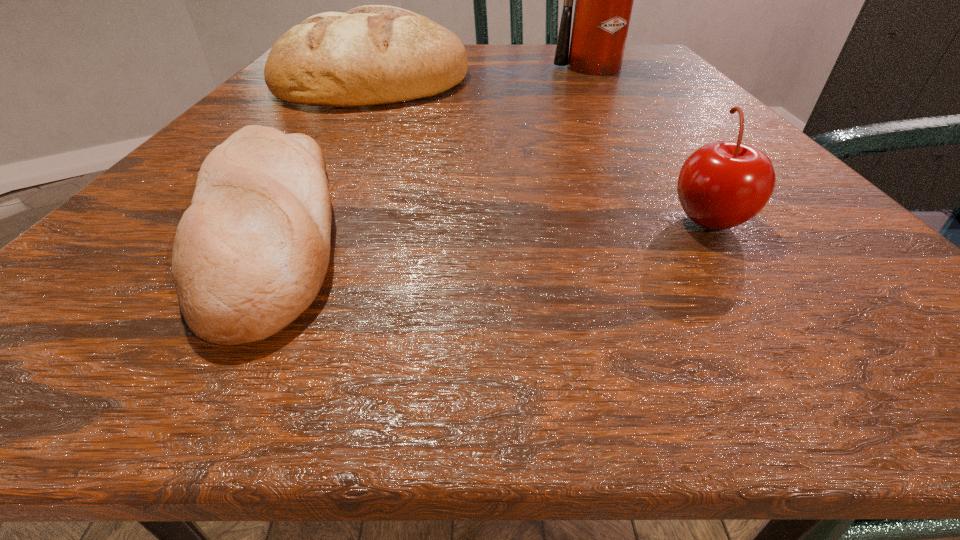
Find the location of a particular element. bread at the far edge is located at coordinates (370, 55).

Find the location of a particular element. object present at the near edge is located at coordinates click(x=250, y=254).

Where is `fire extinguisher that is positioned at the right edge`? The image size is (960, 540). fire extinguisher that is positioned at the right edge is located at coordinates (604, 0).

Identify the location of cherry that is at the right edge. (723, 184).

This screenshot has height=540, width=960. I want to click on object present at the far left corner, so click(370, 55).

Locate an element on the screen. The width and height of the screenshot is (960, 540). object that is at the near left corner is located at coordinates (250, 254).

Identify the location of object positioned at the far right corner. The width and height of the screenshot is (960, 540). (604, 0).

In the image, there is a desktop. At what (x,y) coordinates should I click in order to perform the action: click on vacant space at the far edge. Please return your answer as a coordinate pair (x, y). Looking at the image, I should click on (554, 73).

The height and width of the screenshot is (540, 960). I want to click on vacant space at the left edge of the desktop, so click(271, 93).

What are the coordinates of `vacant space at the right edge of the desktop` in the screenshot? It's located at (709, 126).